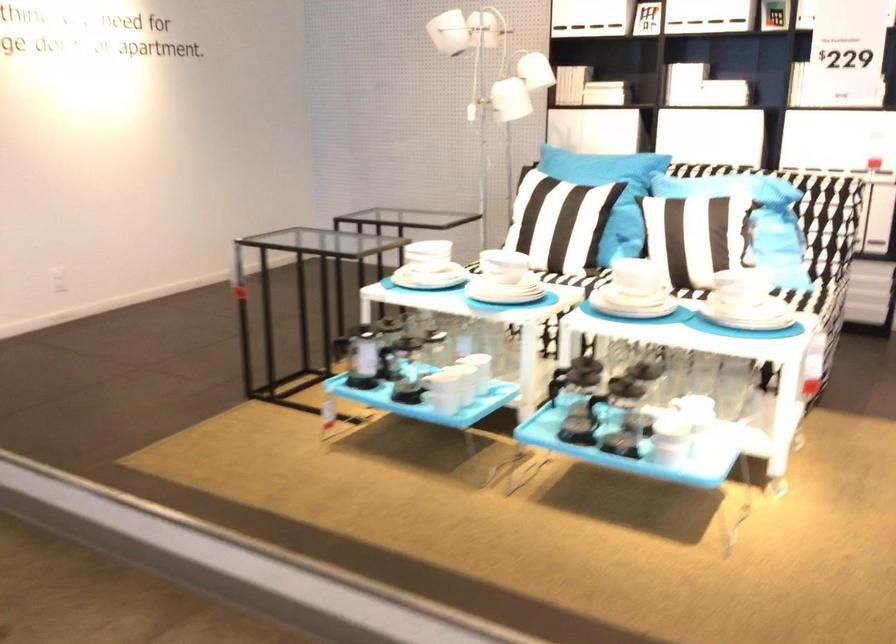
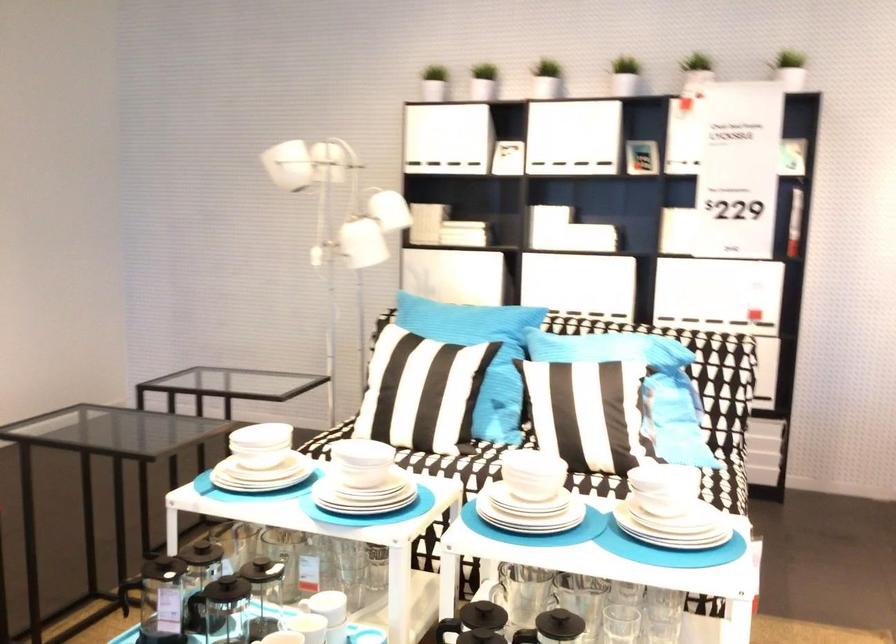
In the second image, find the point that corresponds to the point at 538,205 in the first image.

(398, 377)